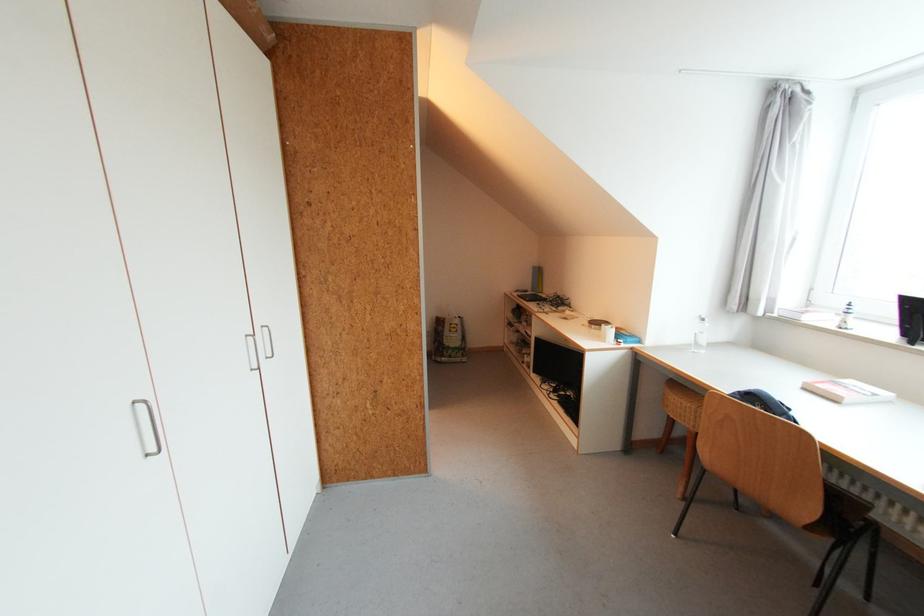
I want to click on small lighthouse figurine, so click(x=845, y=317).